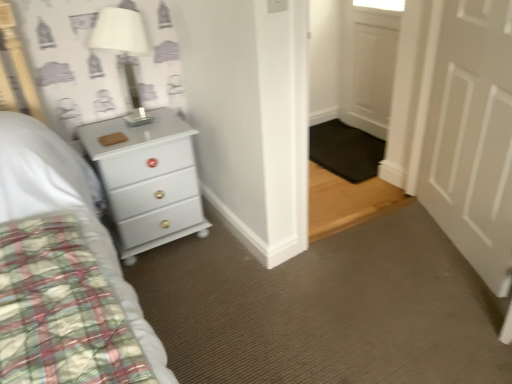
Question: Is white matte lampshade at upper left further to the viewer compared to white glossy chest of drawers at left?

Choices:
 (A) yes
 (B) no

Answer: (B)

Question: From the image's perspective, is white matte lampshade at upper left below white glossy chest of drawers at left?

Choices:
 (A) yes
 (B) no

Answer: (B)

Question: Is white glossy chest of drawers at left completely or partially inside white matte lampshade at upper left?

Choices:
 (A) no
 (B) yes

Answer: (A)

Question: Is white matte lampshade at upper left outside white glossy chest of drawers at left?

Choices:
 (A) no
 (B) yes

Answer: (B)

Question: Considering the relative positions of white matte lampshade at upper left and white glossy chest of drawers at left in the image provided, is white matte lampshade at upper left to the right of white glossy chest of drawers at left from the viewer's perspective?

Choices:
 (A) no
 (B) yes

Answer: (A)

Question: Is white matte lampshade at upper left wider or thinner than white glossy chest of drawers at left?

Choices:
 (A) thin
 (B) wide

Answer: (A)

Question: Considering the positions of white matte lampshade at upper left and white glossy chest of drawers at left in the image, is white matte lampshade at upper left taller or shorter than white glossy chest of drawers at left?

Choices:
 (A) short
 (B) tall

Answer: (A)

Question: Which is correct: white matte lampshade at upper left is inside white glossy chest of drawers at left, or outside of it?

Choices:
 (A) outside
 (B) inside

Answer: (A)

Question: Visually, is white matte lampshade at upper left positioned to the left or to the right of white glossy chest of drawers at left?

Choices:
 (A) left
 (B) right

Answer: (A)

Question: From the image's perspective, is white glossy chest of drawers at left above or below white matte door at right, which is the first door from front to back?

Choices:
 (A) above
 (B) below

Answer: (B)

Question: Is white glossy chest of drawers at left in front of or behind white matte door at right, which is the first door from front to back, in the image?

Choices:
 (A) behind
 (B) front

Answer: (A)

Question: Is point (168, 210) closer or farther from the camera than point (462, 33)?

Choices:
 (A) farther
 (B) closer

Answer: (A)

Question: Is white glossy chest of drawers at left taller or shorter than white matte door at right, which is counted as the second door, starting from the back?

Choices:
 (A) short
 (B) tall

Answer: (A)

Question: Would you say white wooden door at upper right, the 1th door from the back, is inside or outside white glossy chest of drawers at left?

Choices:
 (A) outside
 (B) inside

Answer: (A)

Question: From a real-world perspective, is white wooden door at upper right, the second door positioned from the front, positioned above or below white glossy chest of drawers at left?

Choices:
 (A) above
 (B) below

Answer: (A)